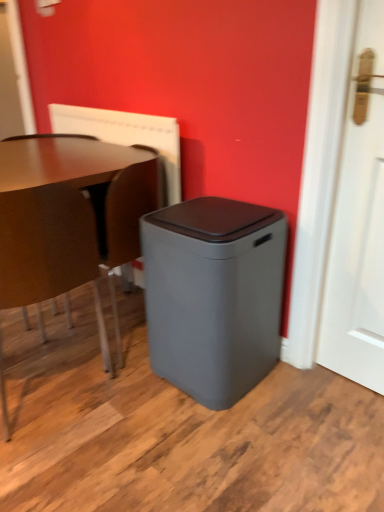
The image size is (384, 512). Find the location of `free space in front of matte brown chair at left`. free space in front of matte brown chair at left is located at coordinates (63, 457).